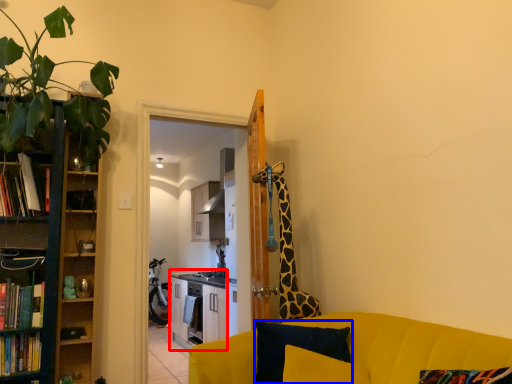
Question: Which point is closer to the camera, entertainment center (highlighted by a red box) or pillow (highlighted by a blue box)?

Choices:
 (A) entertainment center
 (B) pillow

Answer: (B)